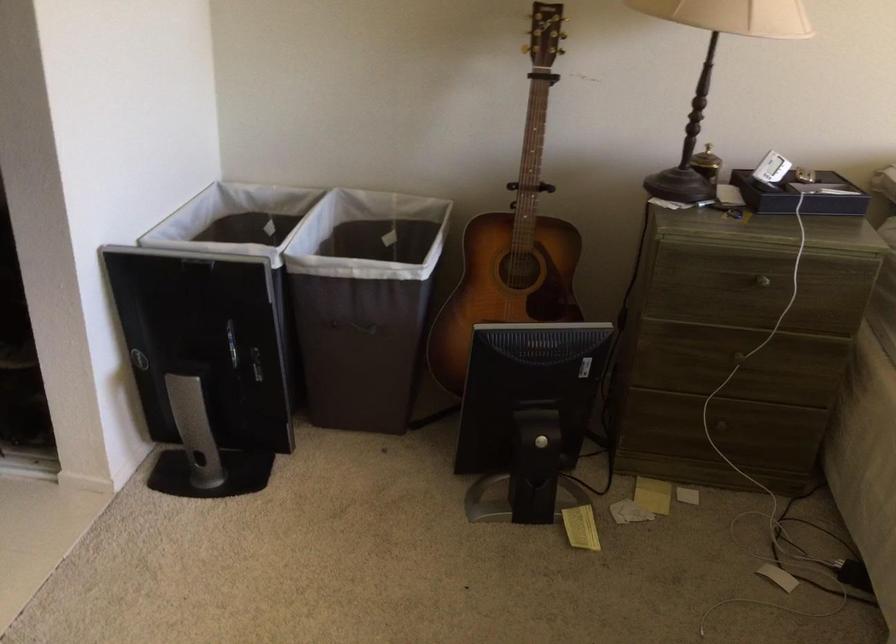
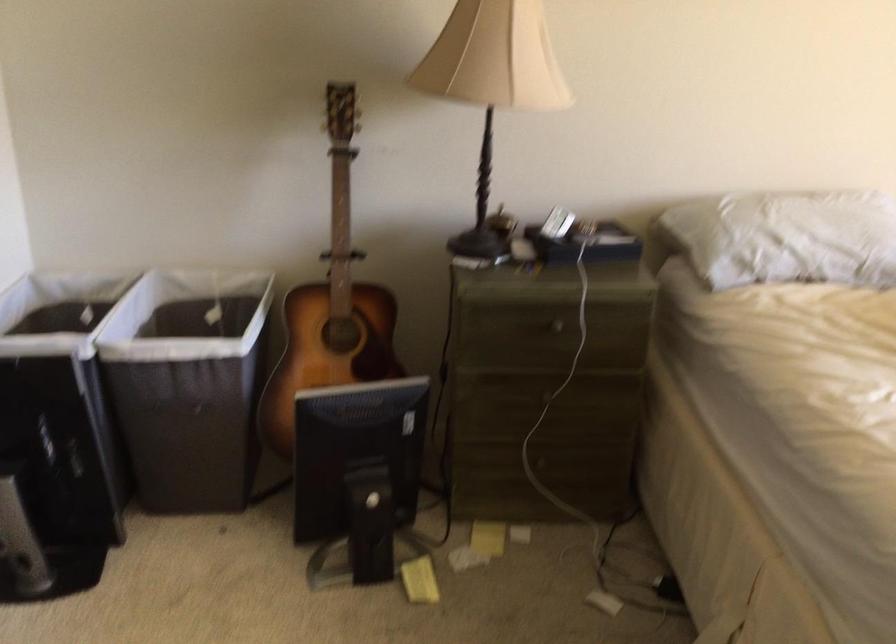
In the second image, find the point that corresponds to pixel 745 281 in the first image.

(545, 328)